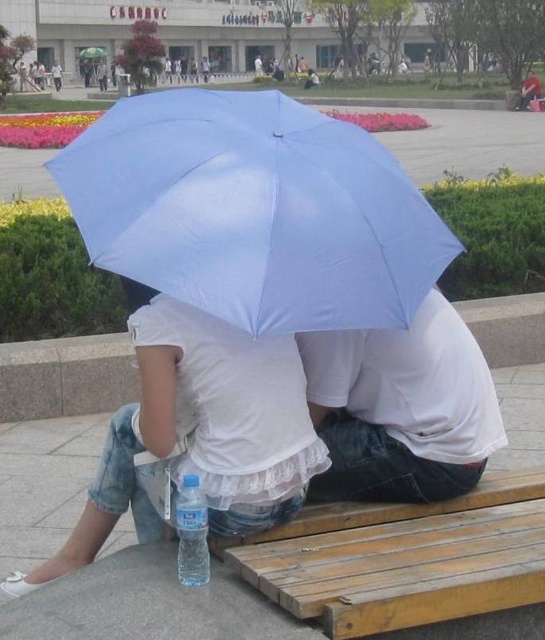
You are a delivery person who needs to place a small package on the bench. The package is 10 cm tall. Considering the white matte umbrella at center and the wooden bench at lower center, will the umbrella block the space where you want to place the package?

The white matte umbrella at center is taller than the wooden bench at lower center, so it might block the space where you want to place the package. Ensure there is enough clearance under the umbrella before placing the package.

You are a photographer trying to capture a candid shot of the two people sitting on the wooden bench at lower center. However, their white matte shirt at center is blocking your view. Can you estimate how much you need to move your camera to the left to fully frame both individuals without the obstruction?

The wooden bench at lower center is positioned under the white matte shirt at center, so moving the camera slightly to the left would allow you to frame both individuals without the obstruction caused by the shirt.

You are a delivery person with a 30 inch wide package that needs to be placed between the light blue fabric umbrella at center and the wooden bench at lower center. Can the package fit in the space between them?

The light blue fabric umbrella at center is 26.20 inches from the wooden bench at lower center. Since the package is 30 inches wide, it cannot fit in the space between them as the distance is less than the package width.